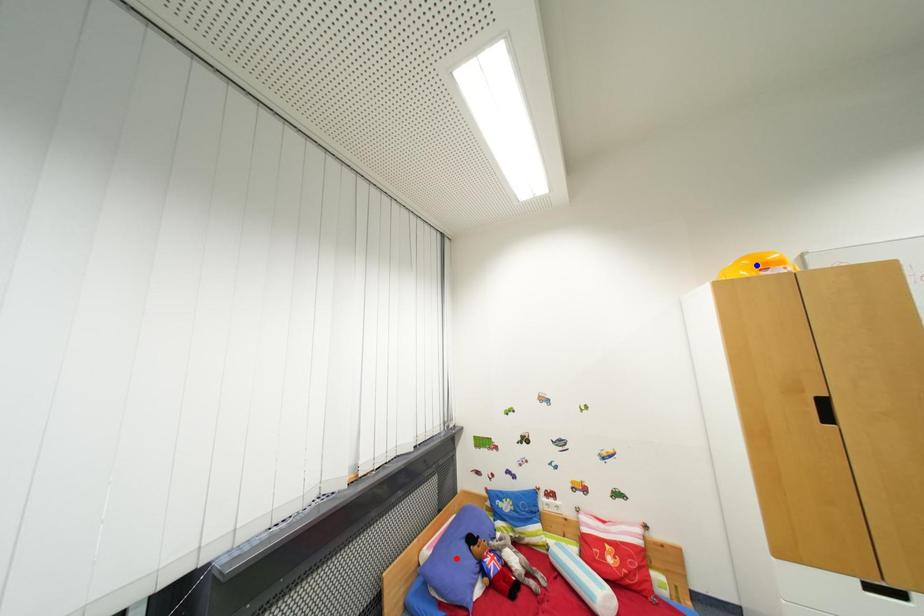
Question: Which of the two points in the image is closer to the camera?

Choices:
 (A) Blue point is closer.
 (B) Red point is closer.

Answer: (A)